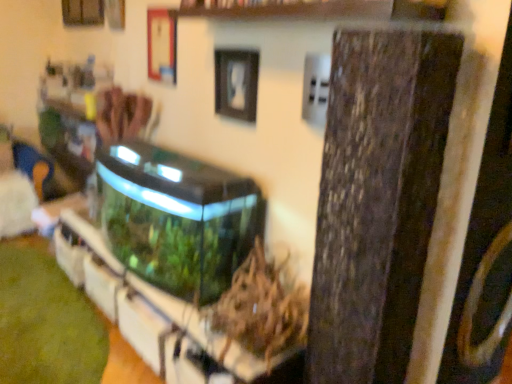
Question: Should I look upward or downward to see green matte plant at center?

Choices:
 (A) up
 (B) down

Answer: (B)

Question: In which direction should I rotate to look at wooden at upper center, which is the 2th shelf from bottom to top?

Choices:
 (A) left
 (B) right

Answer: (B)

Question: Is the position of green matte plant at center more distant than that of transparent glass water tank at center?

Choices:
 (A) no
 (B) yes

Answer: (A)

Question: Does green matte plant at center have a lesser height compared to transparent glass water tank at center?

Choices:
 (A) no
 (B) yes

Answer: (B)

Question: From a real-world perspective, does green matte plant at center sit lower than transparent glass water tank at center?

Choices:
 (A) no
 (B) yes

Answer: (B)

Question: Can you confirm if green matte plant at center is bigger than transparent glass water tank at center?

Choices:
 (A) yes
 (B) no

Answer: (B)

Question: Does green matte plant at center turn towards transparent glass water tank at center?

Choices:
 (A) yes
 (B) no

Answer: (B)

Question: Considering the relative positions of green matte plant at center and transparent glass water tank at center in the image provided, is green matte plant at center to the right of transparent glass water tank at center from the viewer's perspective?

Choices:
 (A) no
 (B) yes

Answer: (B)

Question: Is wooden at upper center, which is the 2th shelf from bottom to top, directly adjacent to transparent glass water tank at center?

Choices:
 (A) no
 (B) yes

Answer: (A)

Question: Is the depth of wooden at upper center, which is the 2th shelf from bottom to top, less than that of transparent glass water tank at center?

Choices:
 (A) yes
 (B) no

Answer: (A)

Question: Can you confirm if wooden at upper center, which is the 2th shelf from bottom to top, is wider than transparent glass water tank at center?

Choices:
 (A) yes
 (B) no

Answer: (B)

Question: Could transparent glass water tank at center be considered to be inside wooden at upper center, which is the 2th shelf from bottom to top?

Choices:
 (A) no
 (B) yes

Answer: (A)

Question: From a real-world perspective, does wooden at upper center, which is the 2th shelf from bottom to top, sit lower than transparent glass water tank at center?

Choices:
 (A) yes
 (B) no

Answer: (B)

Question: From a real-world perspective, is wooden at upper center, the first shelf positioned from the top, on top of transparent glass water tank at center?

Choices:
 (A) no
 (B) yes

Answer: (B)

Question: Does transparent glass water tank at center have a larger size compared to transparent glass aquarium at center, acting as the first shelf starting from the bottom?

Choices:
 (A) no
 (B) yes

Answer: (B)